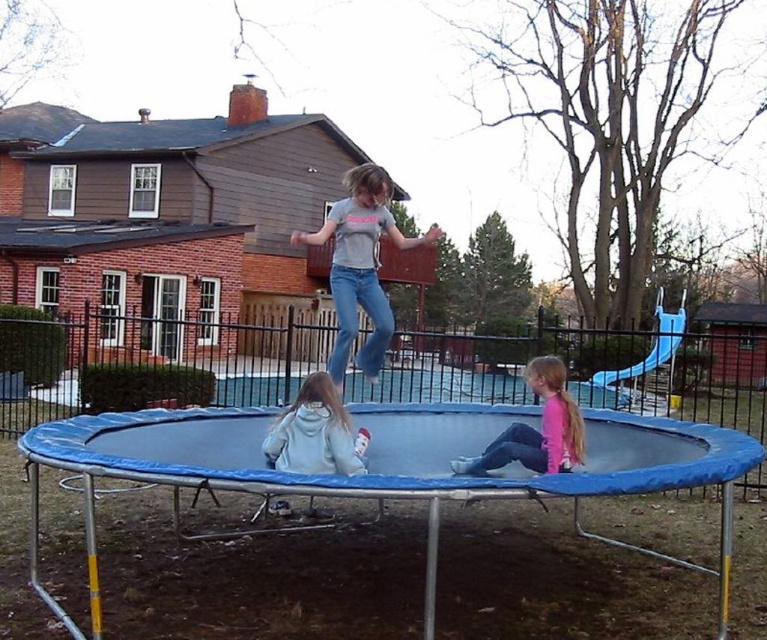
You are standing in the backyard and want to place a new garden bench at the point labeled point [354,264]. If the bench requires a space that is at least 5 meters away from the trampoline to avoid being hit by jumping kids, will this location work?

The distance of point [354,264] from camera is 5.55 meters, which is more than the required 5 meters, so placing the garden bench there would be safe and meet the distance requirement.

You are standing in the backyard and want to place a new garden bench. The bench requires a clear space of 1.5 meters in front of it. If you position the bench so that it faces the blue trampoline at center, will there be enough space between the bench and the trampoline?

The blue trampoline at center is located at point (x=259, y=573). However, without knowing the exact distance between the bench and the trampoline, it is impossible to determine if there is sufficient space. Please provide more information about the placement of the bench relative to the trampoline.

You are a photographer standing in the backyard and want to take a photo of the pink matte shirt at lower center and the light gray hoodie at center. Which of the two objects is closer to you?

The pink matte shirt at lower center is closer to you because it is further to the viewer than the light gray hoodie at center.